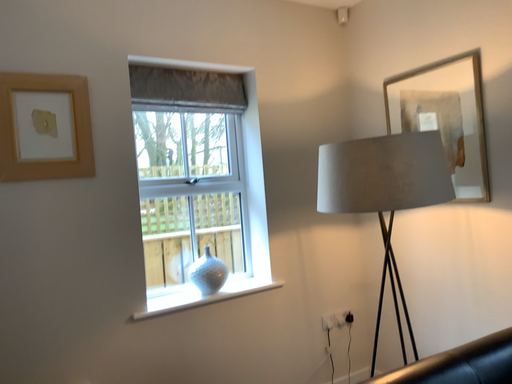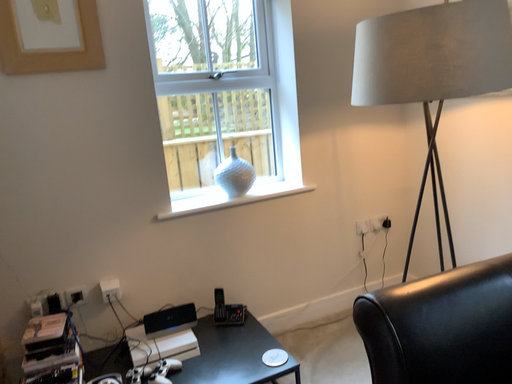
Question: Which way did the camera rotate in the video?

Choices:
 (A) rotated downward
 (B) rotated upward

Answer: (A)